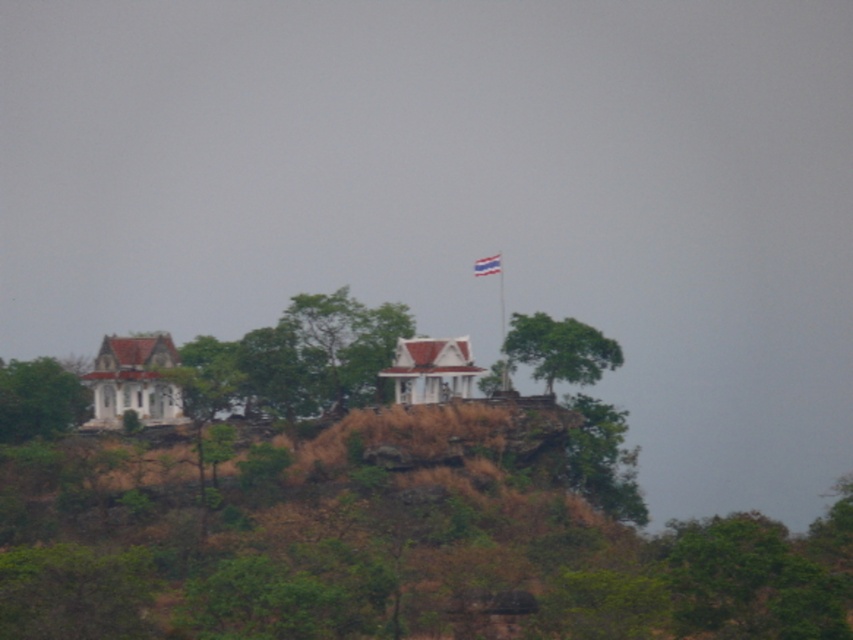
Does green leafy tree at center appear on the right side of white plastic flag pole at upper center?

Incorrect, green leafy tree at center is not on the right side of white plastic flag pole at upper center.

What are the coordinates of `green leafy tree at center` in the screenshot? It's located at (299, 358).

Image resolution: width=853 pixels, height=640 pixels. I want to click on green leafy tree at center, so click(x=299, y=358).

Does point (310, 310) lie behind point (485, 269)?

No, it is in front of (485, 269).

Does green leafy tree at center appear under blue fabric flag at upper center?

Yes, green leafy tree at center is below blue fabric flag at upper center.

You are a GUI agent. You are given a task and a screenshot of the screen. Output one action in this format:
    pyautogui.click(x=<x>, y=<y>)
    Task: Click on the green leafy tree at center
    
    Given the screenshot: What is the action you would take?
    pyautogui.click(x=299, y=358)

At what (x,y) coordinates should I click in order to perform the action: click on blue fabric flag at upper center. Please return your answer as a coordinate pair (x, y). Looking at the image, I should click on pyautogui.click(x=486, y=266).

Describe the element at coordinates (486, 266) in the screenshot. The height and width of the screenshot is (640, 853). I see `blue fabric flag at upper center` at that location.

Does point (496, 260) come farther from viewer compared to point (502, 285)?

No, it is in front of (502, 285).

The width and height of the screenshot is (853, 640). I want to click on blue fabric flag at upper center, so click(486, 266).